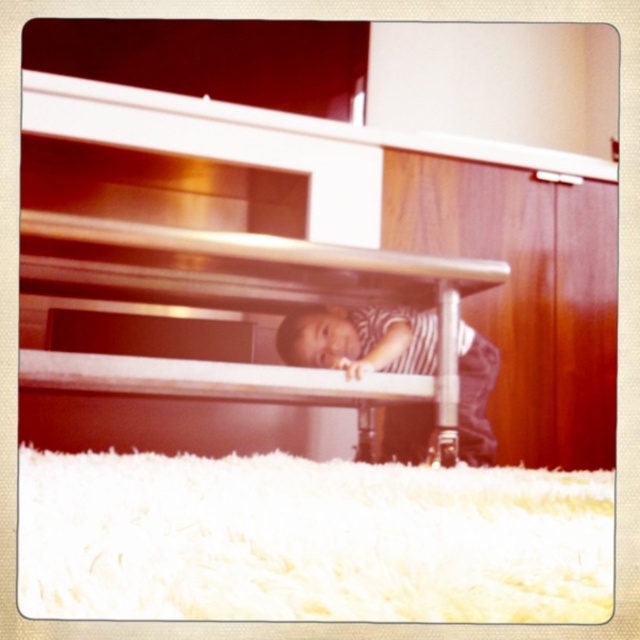
Question: Among these objects, which one is nearest to the camera?

Choices:
 (A) striped fabric toddler at lower center
 (B) matte white bunk bed at lower center

Answer: (B)

Question: Which point is farther to the camera?

Choices:
 (A) striped fabric toddler at lower center
 (B) matte white bunk bed at lower center

Answer: (A)

Question: Is matte white bunk bed at lower center to the right of striped fabric toddler at lower center from the viewer's perspective?

Choices:
 (A) no
 (B) yes

Answer: (A)

Question: Is matte white bunk bed at lower center thinner than striped fabric toddler at lower center?

Choices:
 (A) no
 (B) yes

Answer: (A)

Question: Is matte white bunk bed at lower center positioned before striped fabric toddler at lower center?

Choices:
 (A) no
 (B) yes

Answer: (B)